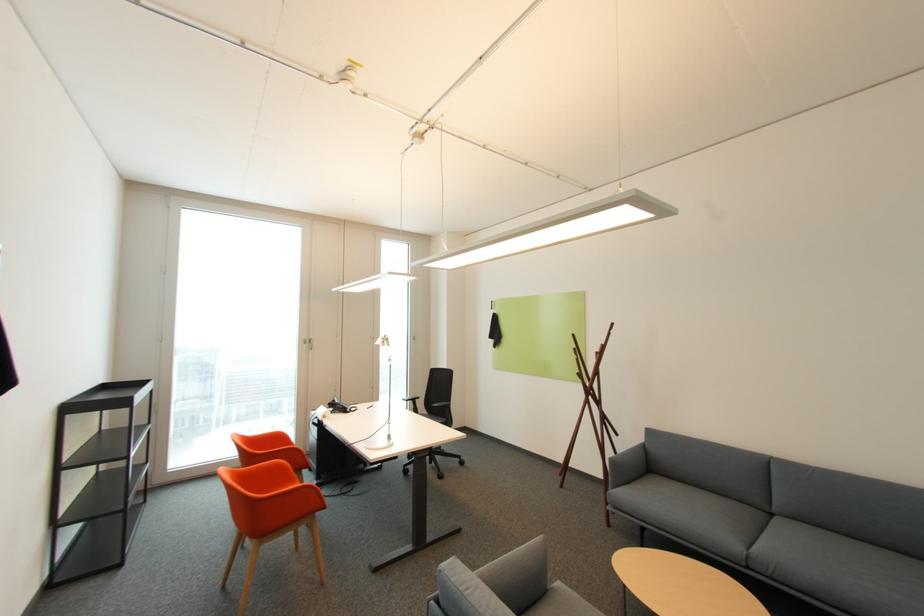
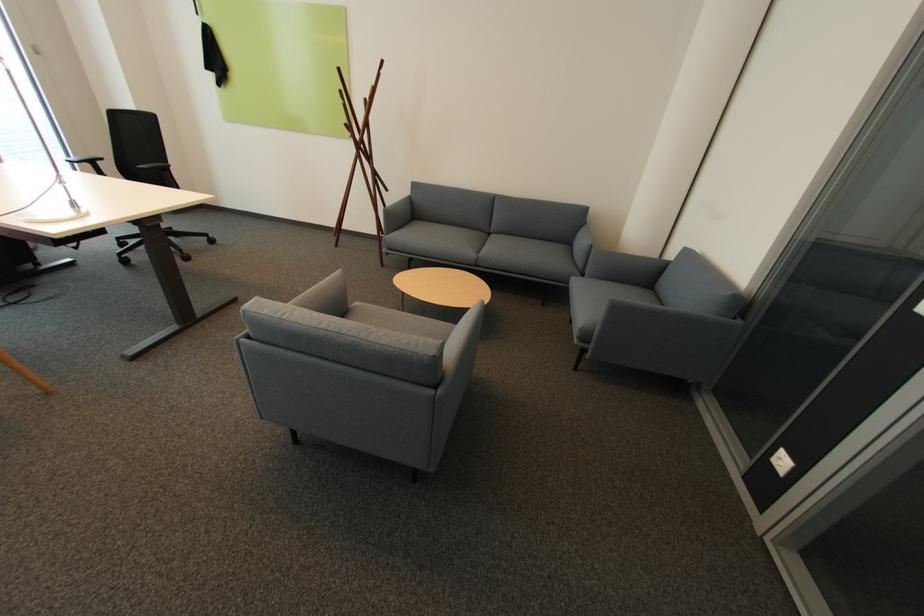
Where in the second image is the point corresponding to (586,376) from the first image?

(355, 126)